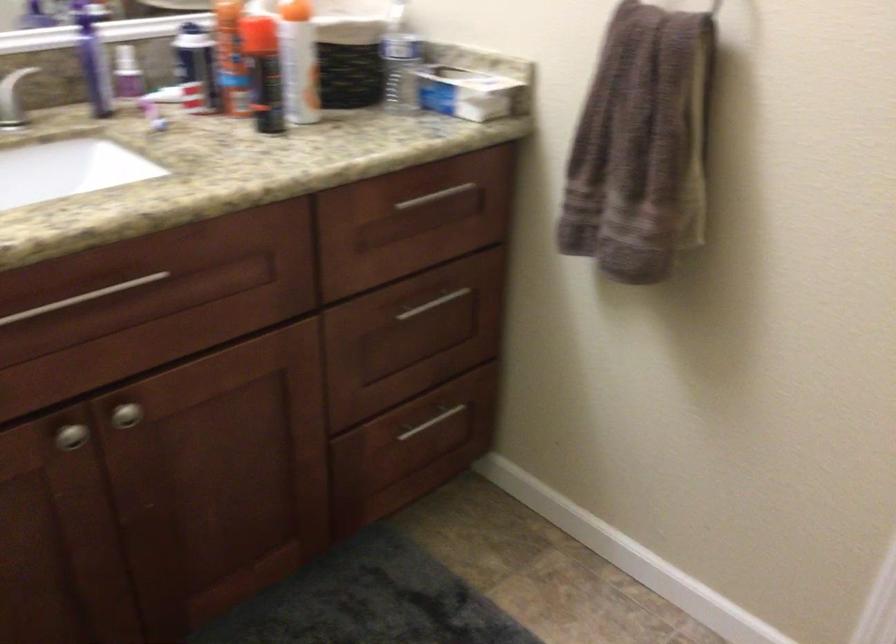
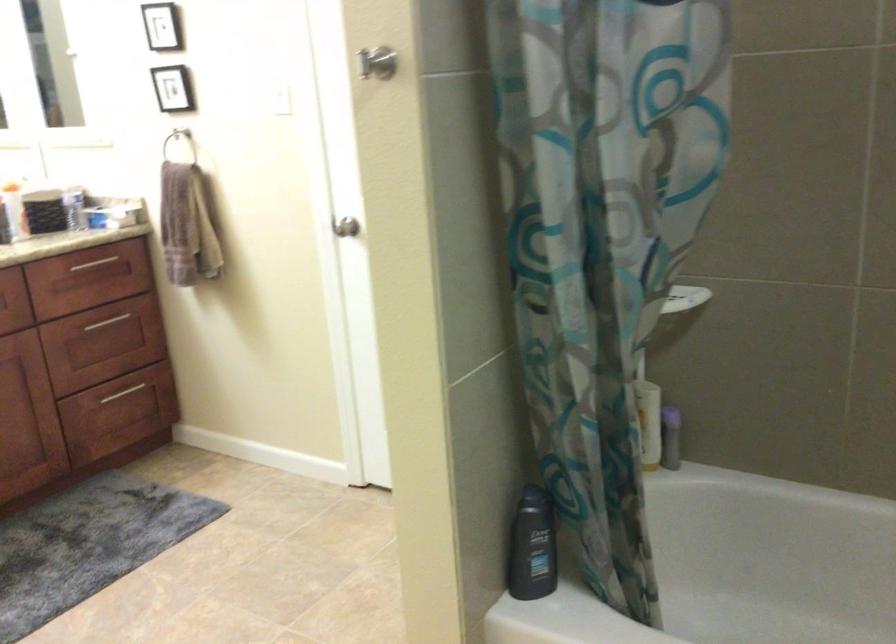
What movement of the cameraman would produce the second image?

The cameraman moved toward right, backward.